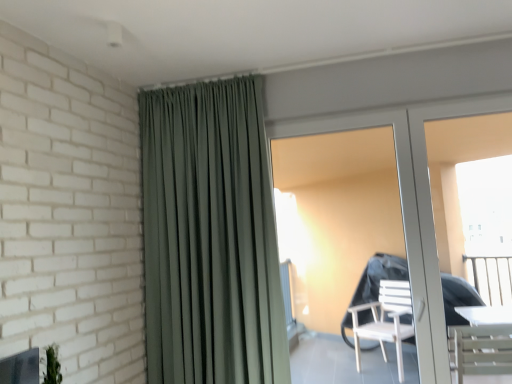
Question: Is white glossy door at center directly adjacent to satin green curtain at upper center?

Choices:
 (A) yes
 (B) no

Answer: (B)

Question: Does white glossy door at center have a greater height compared to satin green curtain at upper center?

Choices:
 (A) yes
 (B) no

Answer: (B)

Question: Can you confirm if white glossy door at center is bigger than satin green curtain at upper center?

Choices:
 (A) yes
 (B) no

Answer: (B)

Question: Is white glossy door at center facing away from satin green curtain at upper center?

Choices:
 (A) no
 (B) yes

Answer: (A)

Question: Is the depth of white glossy door at center greater than that of satin green curtain at upper center?

Choices:
 (A) yes
 (B) no

Answer: (A)

Question: In terms of height, does white glossy door at center look taller or shorter compared to white glossy screen door at right?

Choices:
 (A) short
 (B) tall

Answer: (B)

Question: From a real-world perspective, is white glossy door at center physically located above or below white glossy screen door at right?

Choices:
 (A) above
 (B) below

Answer: (A)

Question: Is white glossy door at center inside the boundaries of white glossy screen door at right, or outside?

Choices:
 (A) inside
 (B) outside

Answer: (B)

Question: Based on their sizes in the image, would you say white glossy door at center is bigger or smaller than white glossy screen door at right?

Choices:
 (A) small
 (B) big

Answer: (B)

Question: Considering the positions of satin green curtain at upper center and white glossy screen door at right in the image, is satin green curtain at upper center taller or shorter than white glossy screen door at right?

Choices:
 (A) tall
 (B) short

Answer: (A)

Question: Based on their sizes in the image, would you say satin green curtain at upper center is bigger or smaller than white glossy screen door at right?

Choices:
 (A) small
 (B) big

Answer: (B)

Question: From the image's perspective, relative to white glossy screen door at right, is satin green curtain at upper center above or below?

Choices:
 (A) below
 (B) above

Answer: (B)

Question: In terms of width, does satin green curtain at upper center look wider or thinner when compared to white glossy screen door at right?

Choices:
 (A) wide
 (B) thin

Answer: (A)

Question: Considering the positions of point (485, 97) and point (435, 306), is point (485, 97) closer or farther from the camera than point (435, 306)?

Choices:
 (A) farther
 (B) closer

Answer: (A)

Question: From a real-world perspective, is white glossy screen door at right positioned above or below white glossy door at center?

Choices:
 (A) above
 (B) below

Answer: (B)